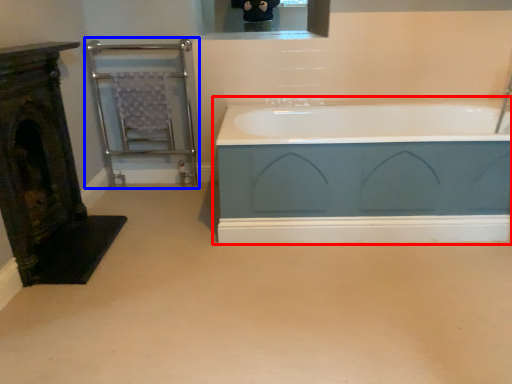
Question: Which object appears closest to the camera in this image, bathtub (highlighted by a red box) or balustrade (highlighted by a blue box)?

Choices:
 (A) bathtub
 (B) balustrade

Answer: (A)